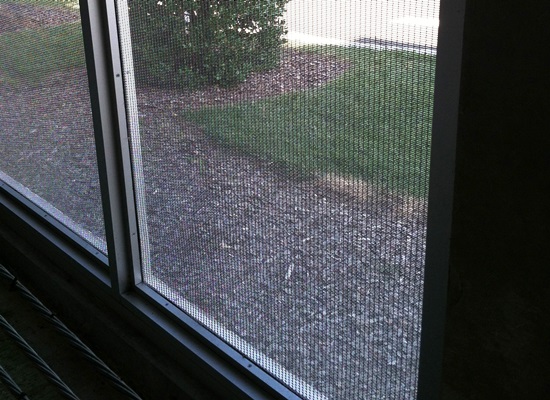
I want to click on 2 windows, so click(x=82, y=204), click(x=202, y=261).